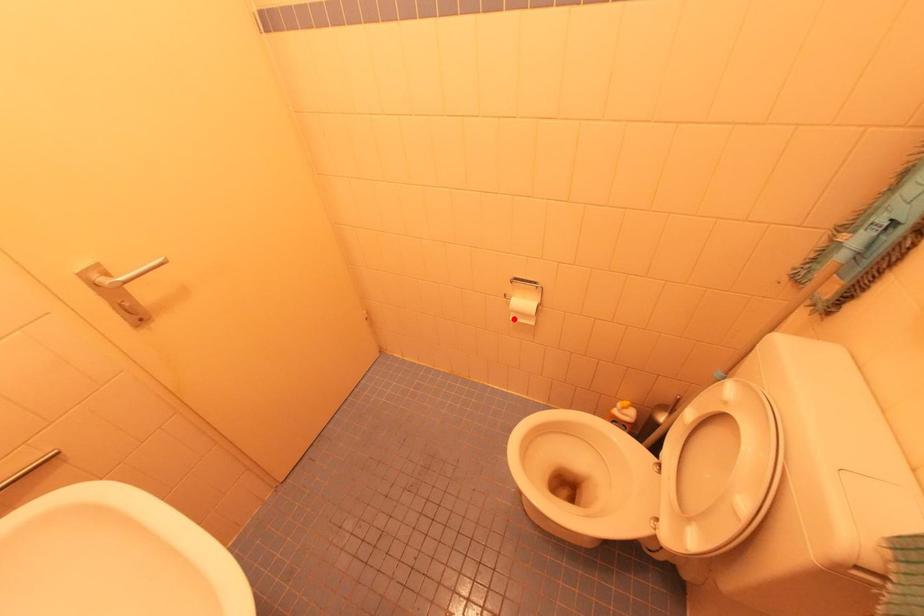
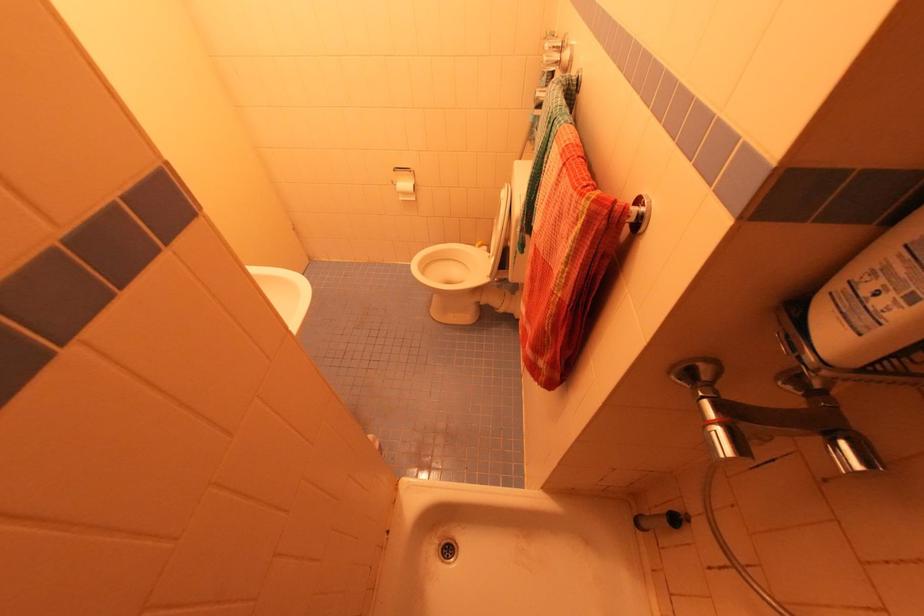
Question: I am providing you with two images of the same scene from different viewpoints. Given a red point in image1, look at the same physical point in image2. Is it:

Choices:
 (A) Closer to the viewpoint
 (B) Farther from the viewpoint

Answer: (A)